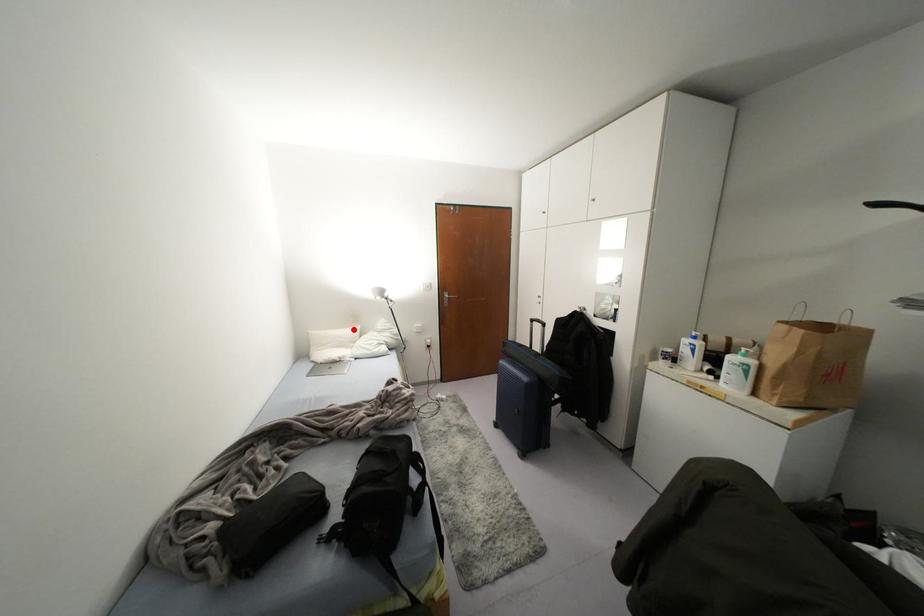
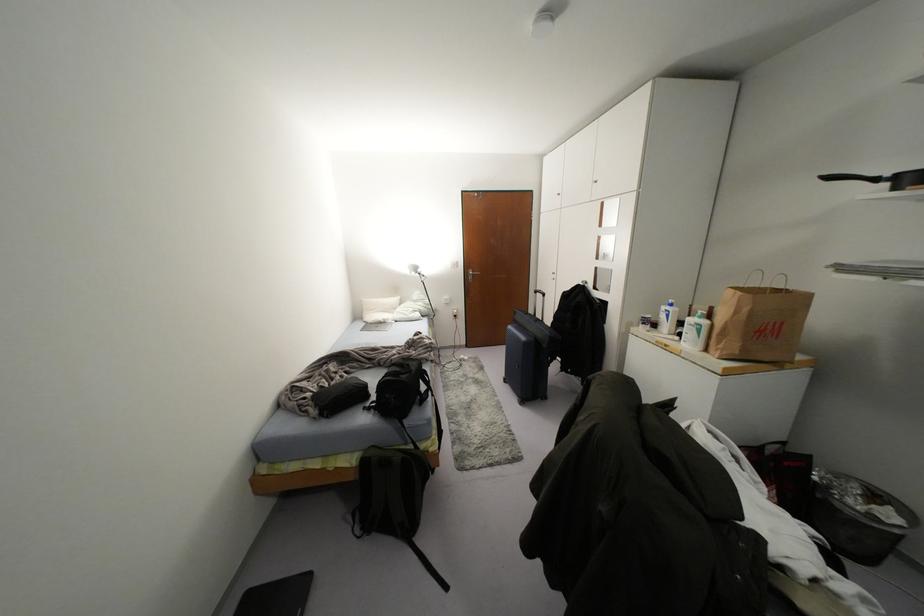
Question: I am providing you with two images of the same scene from different viewpoints. A red point is shown in image1. For the corresponding object point in image2, is it positioned nearer or farther from the camera?

Choices:
 (A) Nearer
 (B) Farther

Answer: (A)